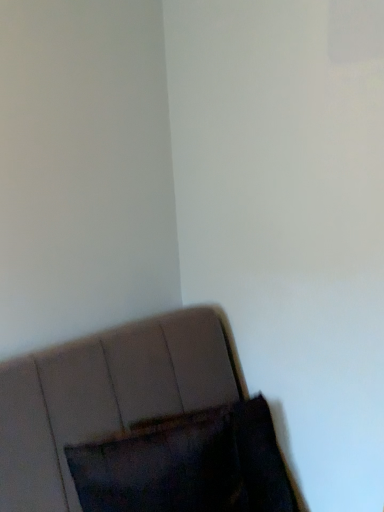
Locate an element on the screen. empty space that is ontop of dark fabric pillow at lower right is located at coordinates (177, 440).